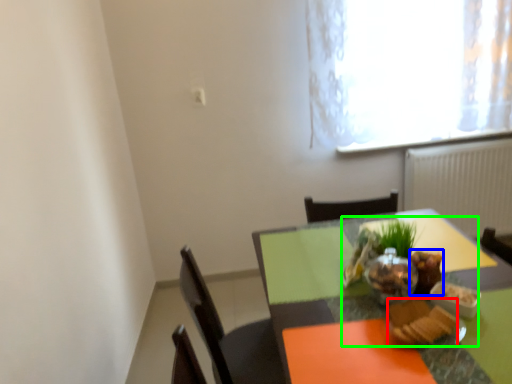
Question: Considering the real-world distances, which object is farthest from food (highlighted by a red box)? food (highlighted by a blue box) or meal (highlighted by a green box)?

Choices:
 (A) food
 (B) meal

Answer: (A)